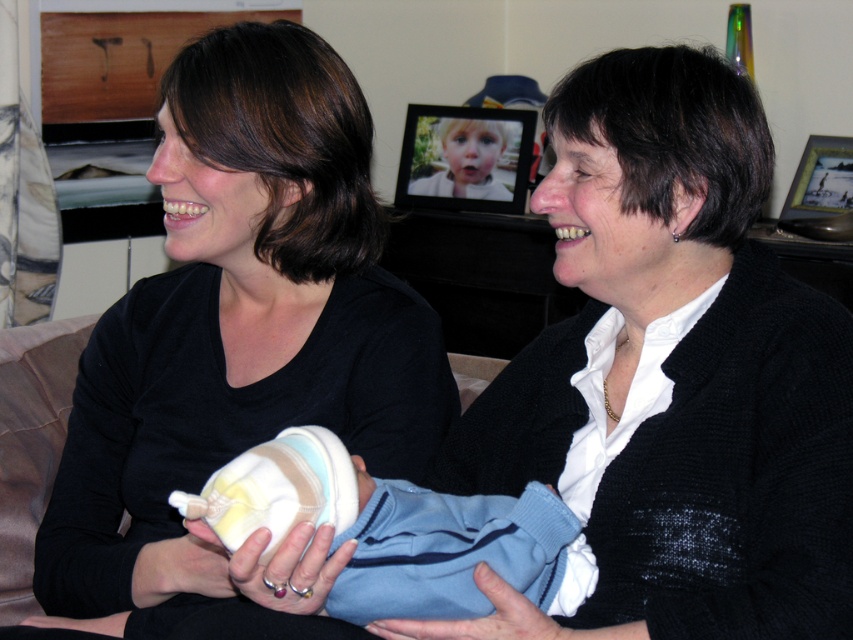
Question: Where is matte black sweater at center located in relation to white soft fabric baby at center in the image?

Choices:
 (A) right
 (B) left

Answer: (A)

Question: Estimate the real-world distances between objects in this image. Which object is farther from the matte black shirt at center?

Choices:
 (A) matte black sweater at center
 (B) white soft fabric baby at center

Answer: (A)

Question: Estimate the real-world distances between objects in this image. Which object is farther from the matte black shirt at center?

Choices:
 (A) white soft fabric baby at center
 (B) matte black sweater at center

Answer: (B)

Question: Observing the image, what is the correct spatial positioning of matte black sweater at center in reference to matte black shirt at center?

Choices:
 (A) above
 (B) below

Answer: (A)

Question: Which object appears farthest from the camera in this image?

Choices:
 (A) matte black sweater at center
 (B) matte black shirt at center
 (C) white soft fabric baby at center

Answer: (B)

Question: Is matte black shirt at center to the left of white soft fabric baby at center from the viewer's perspective?

Choices:
 (A) no
 (B) yes

Answer: (B)